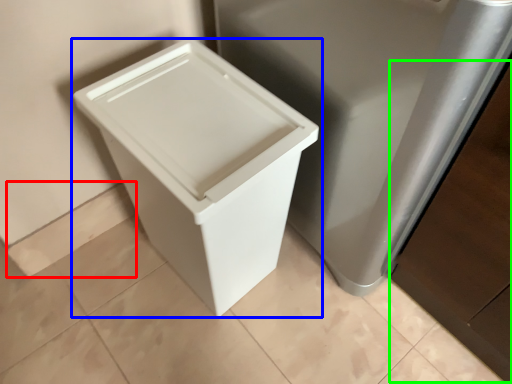
Question: Considering the real-world distances, which object is farthest from square (highlighted by a red box)? waste container (highlighted by a blue box) or cabinetry (highlighted by a green box)?

Choices:
 (A) waste container
 (B) cabinetry

Answer: (B)